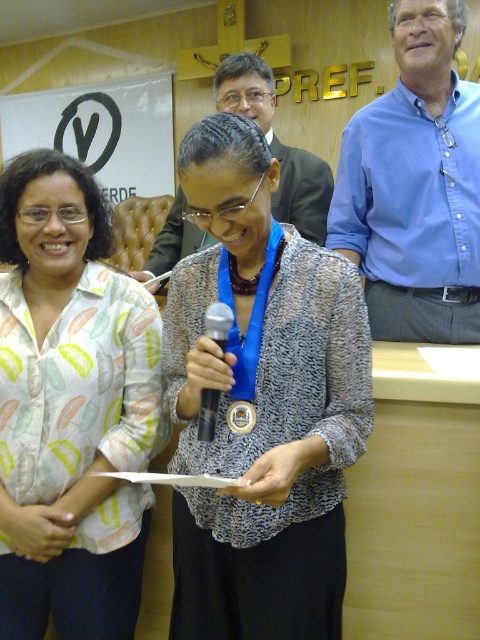
Question: Which point appears farthest from the camera in this image?

Choices:
 (A) (394, 10)
 (B) (4, 376)
 (C) (283, 186)

Answer: (C)

Question: From the image, what is the correct spatial relationship of matte black suit at center in relation to gold metallic medal at center?

Choices:
 (A) left
 (B) right

Answer: (B)

Question: Which point is closer to the camera taking this photo?

Choices:
 (A) pyautogui.click(x=463, y=115)
 (B) pyautogui.click(x=237, y=406)
 (C) pyautogui.click(x=203, y=381)
 (D) pyautogui.click(x=34, y=593)

Answer: (C)

Question: Is blue cotton shirt at upper right smaller than matte black suit at center?

Choices:
 (A) no
 (B) yes

Answer: (A)

Question: Which of the following is the farthest from the observer?

Choices:
 (A) (254, 68)
 (B) (248, 432)
 (C) (101, 192)

Answer: (A)

Question: Is white printed blouse at left to the right of gold metallic medal at center from the viewer's perspective?

Choices:
 (A) no
 (B) yes

Answer: (A)